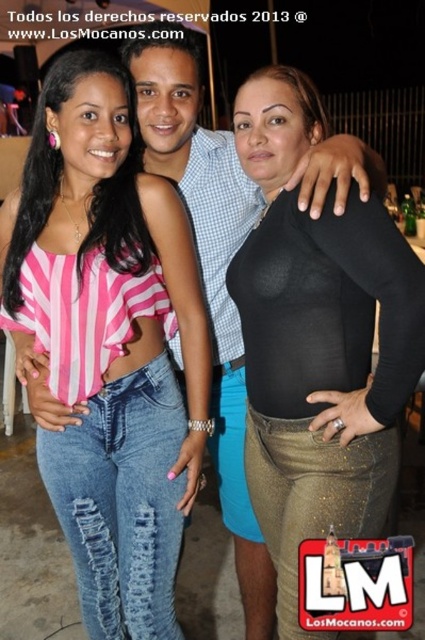
Question: Does pink striped fabric top at upper left come behind black matte bodysuit at center?

Choices:
 (A) yes
 (B) no

Answer: (A)

Question: Which object is closer to the camera taking this photo?

Choices:
 (A) pink striped fabric top at upper left
 (B) black matte bodysuit at center

Answer: (B)

Question: In this image, where is pink striped fabric top at upper left located relative to black matte bodysuit at center?

Choices:
 (A) below
 (B) above

Answer: (A)

Question: Is pink striped fabric top at upper left thinner than black matte bodysuit at center?

Choices:
 (A) no
 (B) yes

Answer: (A)